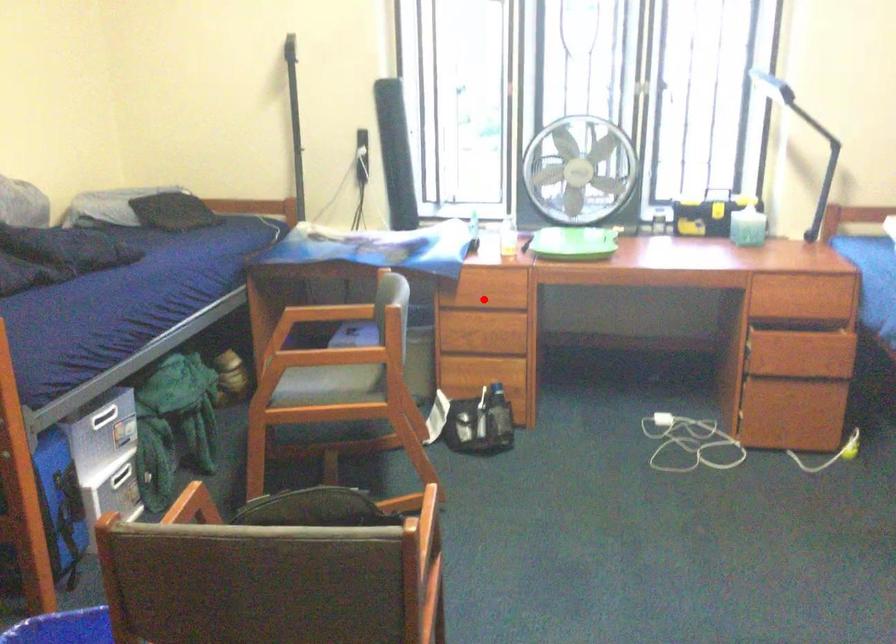
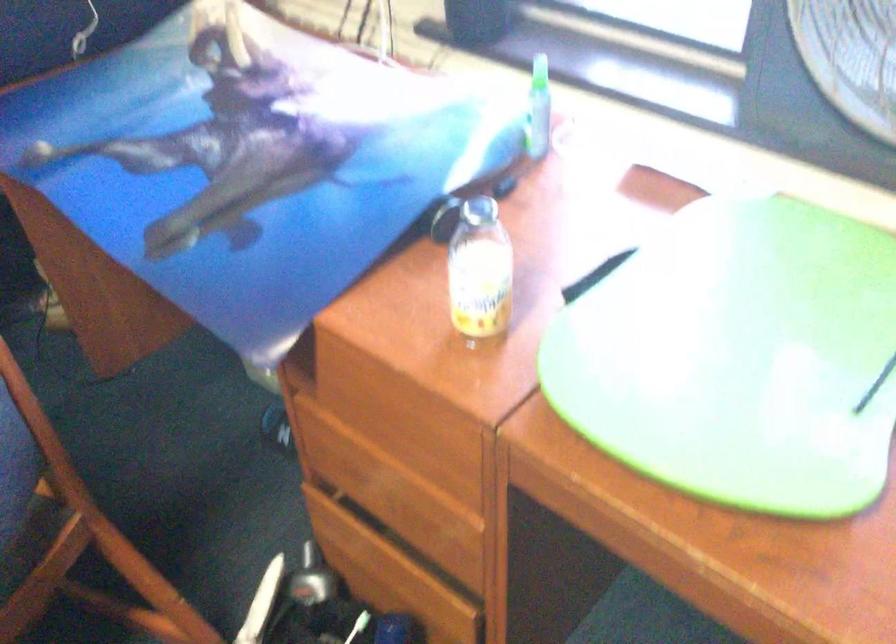
In the second image, find the point that corresponds to the highlighted location in the first image.

(383, 435)